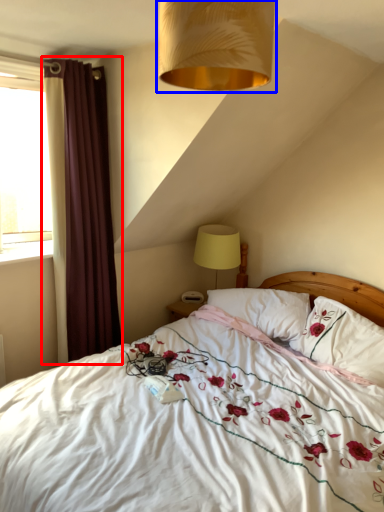
Question: Which object is further to the camera taking this photo, curtain (highlighted by a red box) or lamp (highlighted by a blue box)?

Choices:
 (A) curtain
 (B) lamp

Answer: (A)